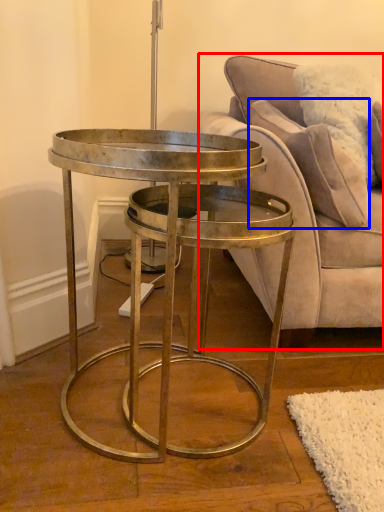
Question: Among these objects, which one is farthest to the camera, studio couch (highlighted by a red box) or pillow (highlighted by a blue box)?

Choices:
 (A) studio couch
 (B) pillow

Answer: (B)